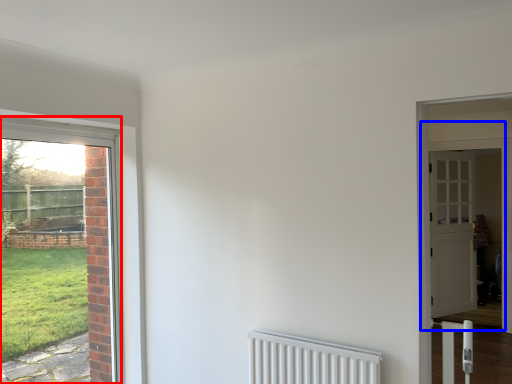
Question: Among these objects, which one is nearest to the camera, door (highlighted by a red box) or door (highlighted by a blue box)?

Choices:
 (A) door
 (B) door

Answer: (A)